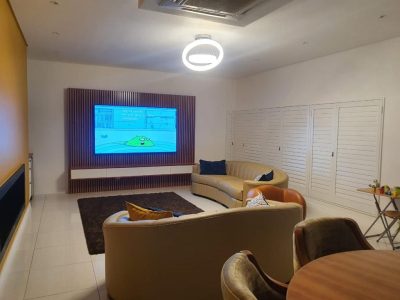
Identify the location of table. (355, 262).